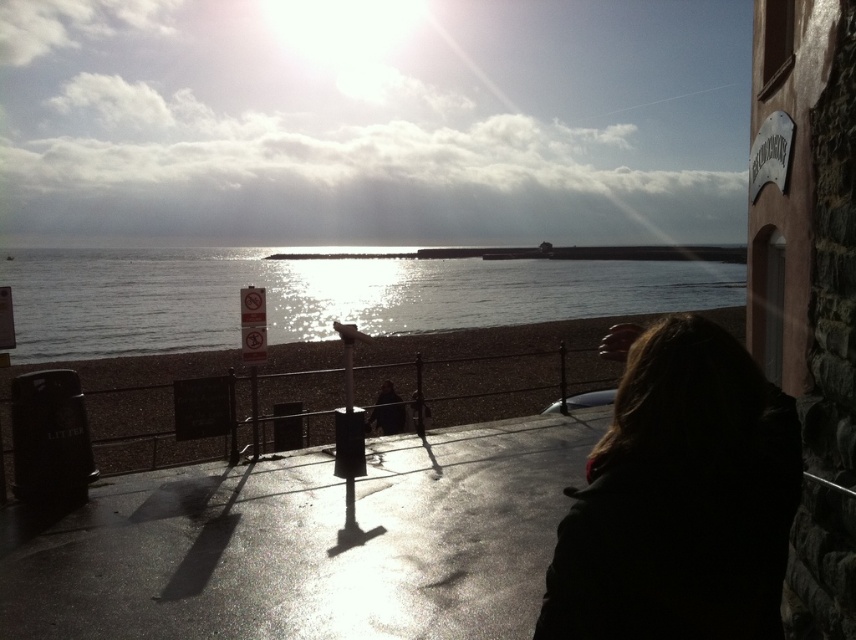
You are standing on a coastal path and see the dark brown hair at lower right and the smooth sand at lower center. Which object is closer to you?

The dark brown hair at lower right is closer to you because it is in front of the smooth sand at lower center.

In the scene shown: You are a photographer standing on the paved area near the metal railing. You notice the dark brown hair at lower right and the smooth sand at lower center. Which object appears smaller in the image?

The dark brown hair at lower right appears smaller than the smooth sand at lower center in the image.